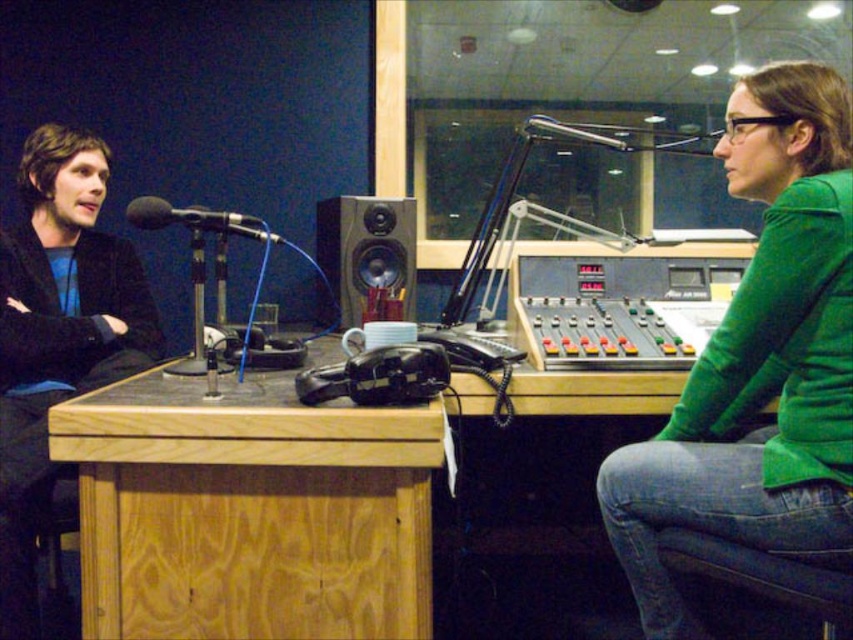
Question: Can you confirm if matte black jacket at left is thinner than wooden speaker at center?

Choices:
 (A) no
 (B) yes

Answer: (A)

Question: Is wooden speaker at center wider than black matte microphone at left?

Choices:
 (A) yes
 (B) no

Answer: (A)

Question: Which object is closer to the camera taking this photo?

Choices:
 (A) wooden desk at center
 (B) black matte microphone at left
 (C) matte black jacket at left
 (D) wooden speaker at center

Answer: (A)

Question: Is green matte shirt at upper right bigger than black matte microphone at left?

Choices:
 (A) yes
 (B) no

Answer: (A)

Question: Which point is closer to the camera?

Choices:
 (A) (405, 248)
 (B) (735, 104)
 (C) (45, 132)
 (D) (277, 240)

Answer: (B)

Question: Which point is closer to the camera?

Choices:
 (A) matte black jacket at left
 (B) black matte microphone at left
 (C) green matte shirt at upper right

Answer: (C)